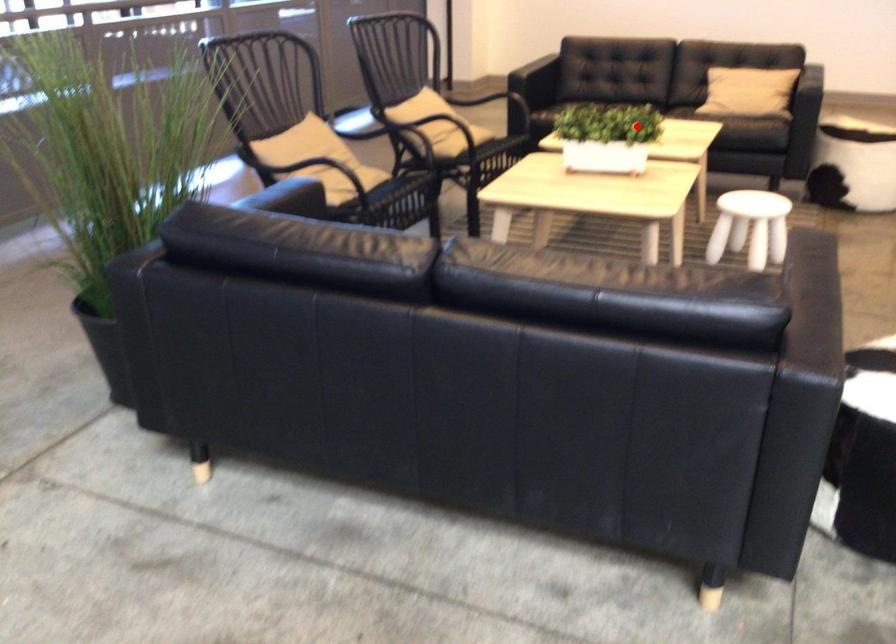
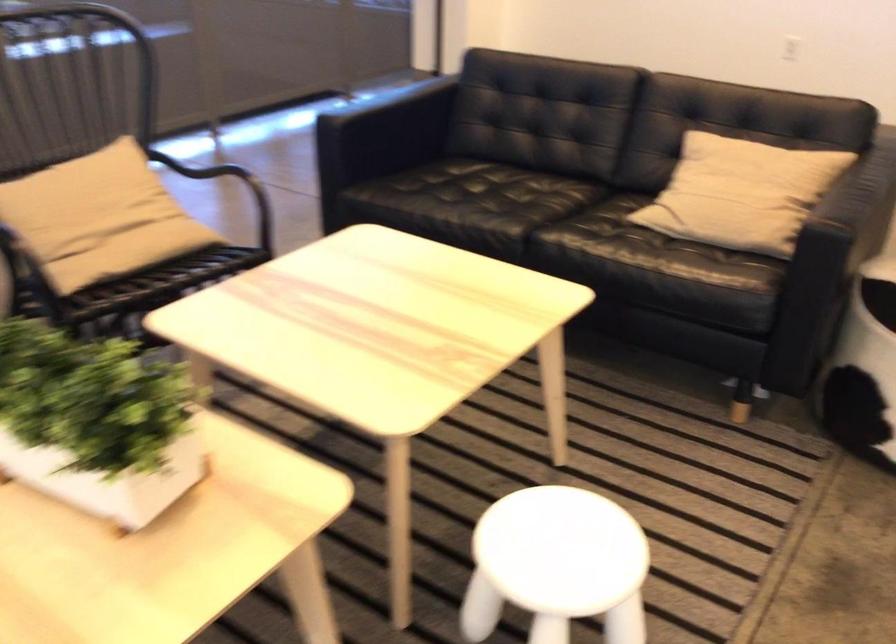
Find the pixel in the second image that matches the highlighted location in the first image.

(96, 422)